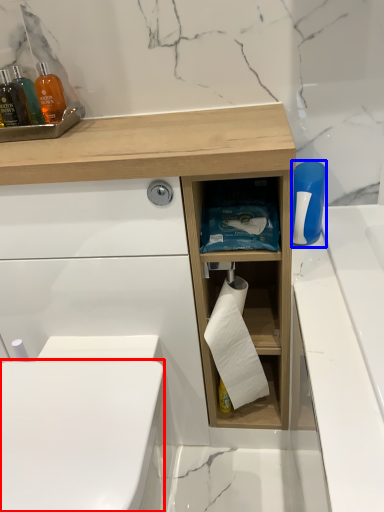
Question: Among these objects, which one is farthest to the camera, toilet bowl (highlighted by a red box) or cleaning product (highlighted by a blue box)?

Choices:
 (A) toilet bowl
 (B) cleaning product

Answer: (B)